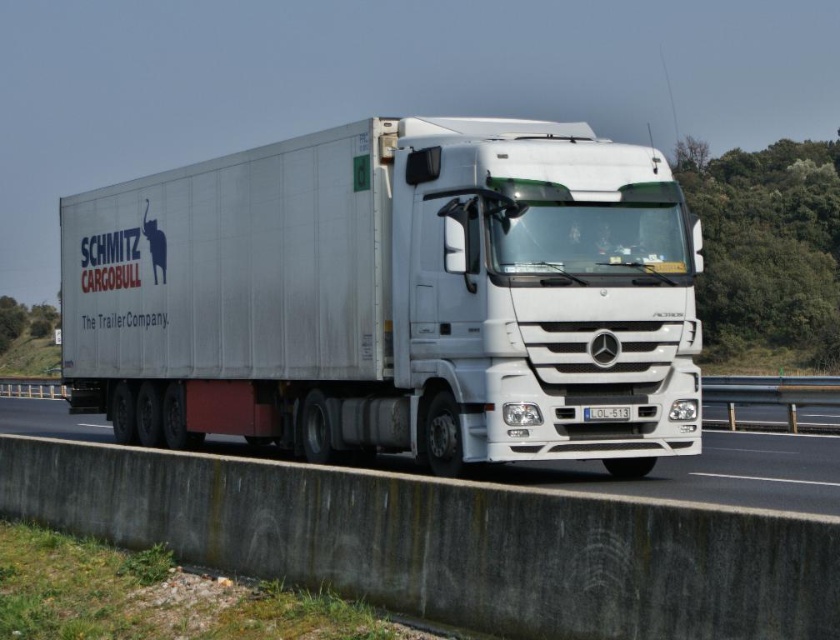
This screenshot has height=640, width=840. What are the coordinates of `white metallic trailer truck at center` in the screenshot? It's located at (394, 298).

Between point (421, 148) and point (749, 412), which one is positioned in front?

Positioned in front is point (421, 148).

This screenshot has height=640, width=840. I want to click on white metallic trailer truck at center, so click(x=394, y=298).